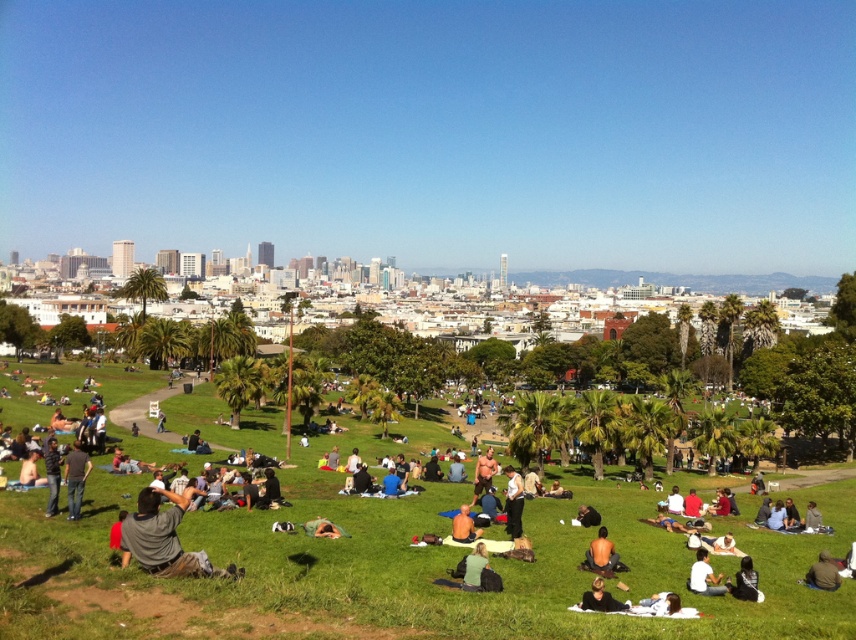
Looking at this image, you are planning to take a photo of the dark gray hoodie at lower right and the tan skin person at center. If the camera can only focus on objects wider than 1 meter, will both objects be in focus?

The dark gray hoodie at lower right is narrower than the tan skin person at center. Since the hoodie is less than 1 meter in width, it might not be in focus, but the tan skin person at center could be in focus if their width exceeds 1 meter. However, the exact focus depends on the camera settings and distance, so it is uncertain without more information.

You are standing at the point with coordinates point (x=587, y=506) and want to walk towards the point with coordinates point (x=591, y=540). According to the park layout, will you be moving towards the city skyline or away from it?

Point (x=591, y=540) is in front of point (x=587, y=506). Since the city skyline is in the background, moving towards the point (x=591, y=540) would mean moving towards the city skyline.